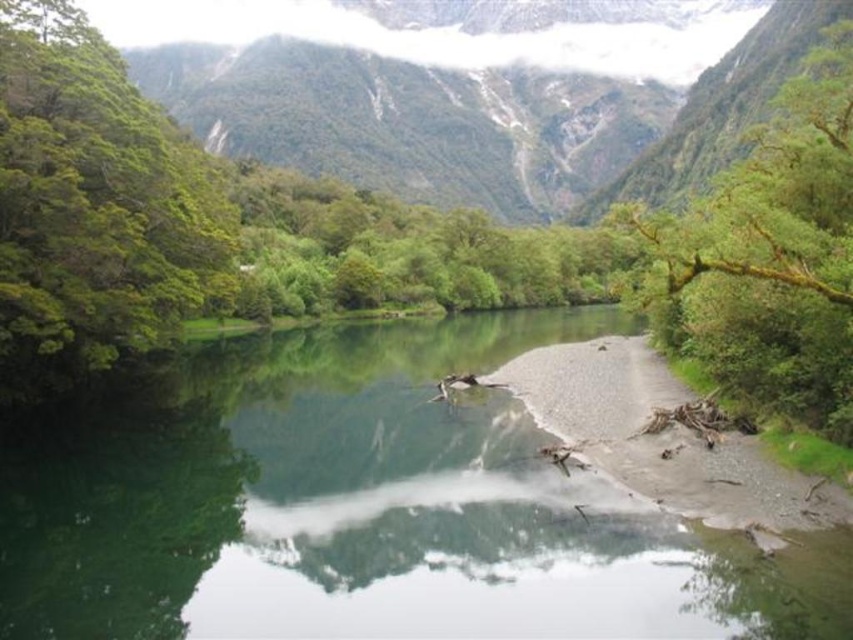
You are an environmental scientist assessing the ecological balance of this landscape. You observe the green leafy tree at left and the green mossy branch at upper right. Which object takes up more area in the scene?

The green mossy branch at upper right occupies more space than the green leafy tree at left.

You are standing at the center of the image and want to walk towards the green leafy tree at left. Which direction should you head?

The green leafy tree at left is located at point coordinates suggesting it is to the left side of the image. Since you are at the center, you should head towards the left direction to reach it.

You are standing at the edge of the water in the serene landscape. You notice two points marked in the scene. Which point, point [454,492] or point [820,156], is closer to you?

Point [454,492] is closer to the viewer than point [820,156].